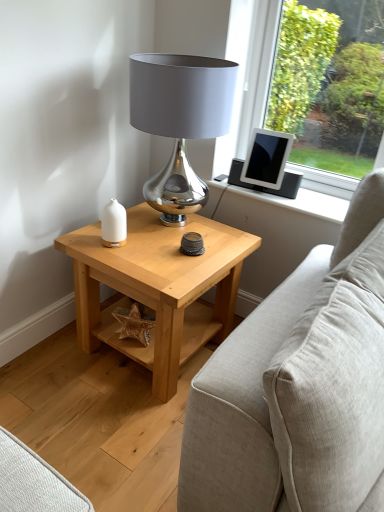
Image resolution: width=384 pixels, height=512 pixels. Identify the location of empty space that is ontop of light wood/texture side table at center (from a real-world perspective). 160,246.